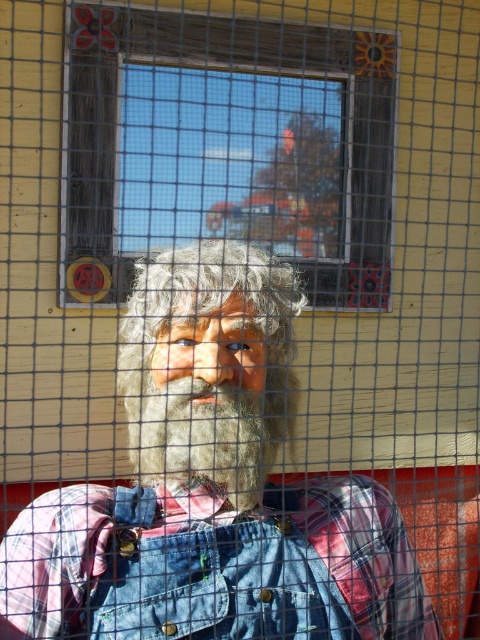
You are standing in a room and want to look outside through the clear glass window at center. Where should you position yourself to ensure you can see through the window without obstruction from the scarecrow figure?

The clear glass window at center is located at point (227, 147), so you should position yourself in front of that coordinate to see through it without obstruction from the scarecrow figure.

You are a painter standing in front of the clear glass window at center and the fuzzy brown beard at center. You want to paint both objects but have limited canvas space. Which object should you prioritize painting first to ensure it fits on your canvas?

The clear glass window at center is larger in size than the fuzzy brown beard at center, so you should prioritize painting the fuzzy brown beard at center first to ensure it fits on the canvas before the larger window.